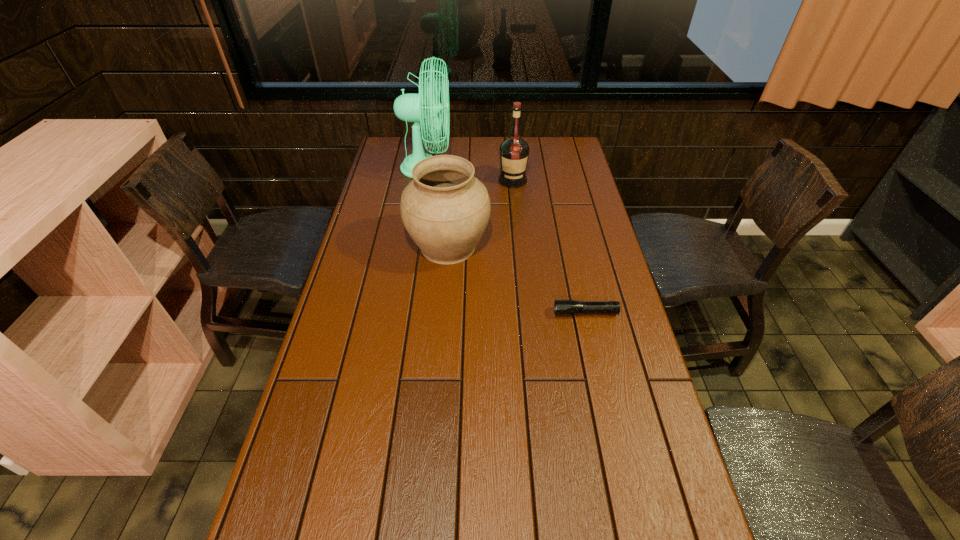
The height and width of the screenshot is (540, 960). I want to click on blank region between the rightmost object and the fan, so click(506, 240).

Where is `vacant area that lies between the shortest object and the third object from left to right`? The image size is (960, 540). vacant area that lies between the shortest object and the third object from left to right is located at coordinates (549, 247).

Image resolution: width=960 pixels, height=540 pixels. I want to click on object that is the second closest to the flashlight, so click(x=514, y=152).

This screenshot has width=960, height=540. In order to click on object that is the second closest to the shortest object in this screenshot , I will do (x=514, y=152).

This screenshot has height=540, width=960. Identify the location of vacant space that satisfies the following two spatial constraints: 1. in front of the urn to blow air; 2. on the right side of the tallest object. (414, 246).

Locate an element on the screen. free location that satisfies the following two spatial constraints: 1. on the back side of the third farthest object; 2. in front of the fan to blow air is located at coordinates (454, 168).